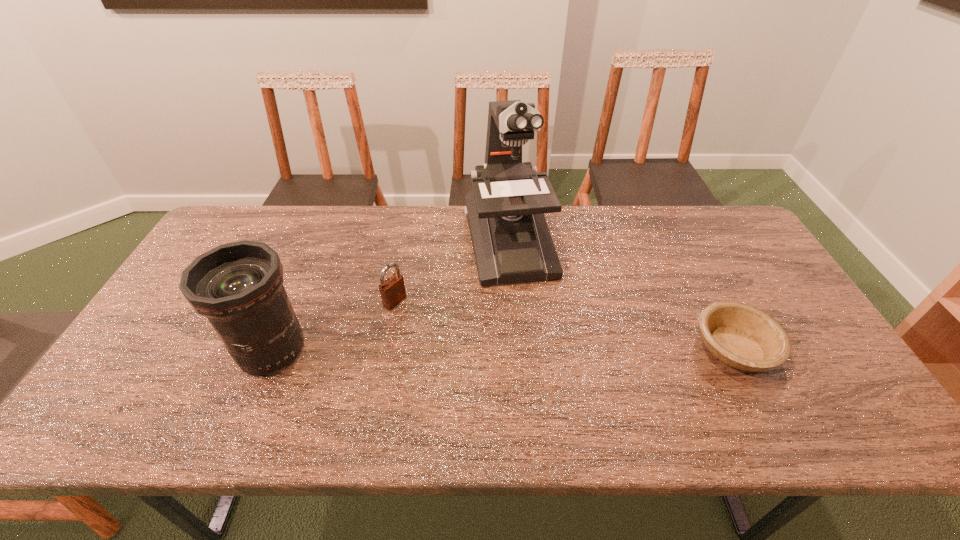
The image size is (960, 540). Find the location of `the second tallest object`. the second tallest object is located at coordinates (238, 286).

Locate an element on the screen. the leftmost object is located at coordinates (238, 286).

The height and width of the screenshot is (540, 960). In order to click on bowl in this screenshot , I will do `click(741, 336)`.

You are a GUI agent. You are given a task and a screenshot of the screen. Output one action in this format:
    pyautogui.click(x=<x>, y=<y>)
    Task: Click on the shortest object
    The height and width of the screenshot is (540, 960).
    Given the screenshot: What is the action you would take?
    pyautogui.click(x=741, y=336)

You are a GUI agent. You are given a task and a screenshot of the screen. Output one action in this format:
    pyautogui.click(x=<x>, y=<y>)
    Task: Click on the microscope
    This screenshot has height=540, width=960.
    Given the screenshot: What is the action you would take?
    pyautogui.click(x=511, y=240)

What are the coordinates of `the farthest object` in the screenshot? It's located at (511, 240).

Identify the location of the second object from left to right. This screenshot has width=960, height=540. (392, 291).

Find the location of a particular element. The height and width of the screenshot is (540, 960). the second shortest object is located at coordinates 392,291.

At what (x,y) coordinates should I click in order to perform the action: click on free space located on the back of the telephoto lens. Please return your answer as a coordinate pair (x, y). The image size is (960, 540). Looking at the image, I should click on click(x=319, y=236).

What are the coordinates of `vacant space located on the back of the rightmost object` in the screenshot? It's located at (673, 229).